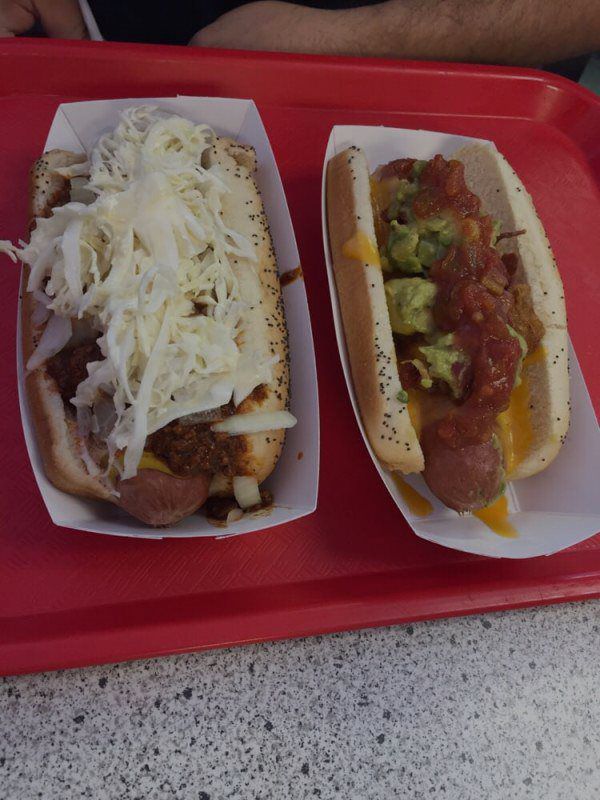
Where is `formica counter`? The height and width of the screenshot is (800, 600). formica counter is located at coordinates (234, 726).